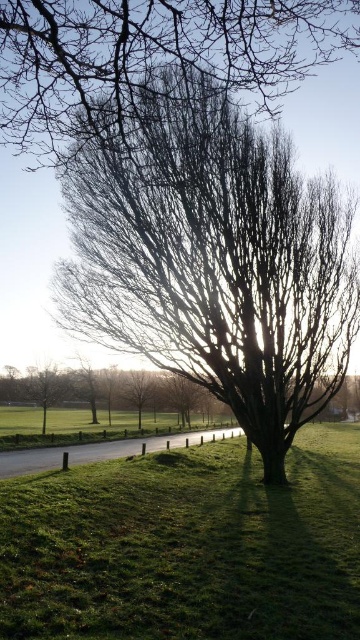
Question: Which object is farther from the camera taking this photo?

Choices:
 (A) bare branches at center
 (B) green leafless tree at lower left
 (C) smooth bark tree at center

Answer: (C)

Question: Which is nearer to the green leafless tree at lower left?

Choices:
 (A) bare branches at center
 (B) green grassy at center
 (C) smooth bark tree at center

Answer: (C)

Question: Is green matte tree at lower left thinner than smooth bark tree at center?

Choices:
 (A) yes
 (B) no

Answer: (A)

Question: Does green grassy at center appear under green matte tree at lower left?

Choices:
 (A) no
 (B) yes

Answer: (A)

Question: Is bare branches at center to the left of smooth bark tree at center from the viewer's perspective?

Choices:
 (A) no
 (B) yes

Answer: (A)

Question: Considering the real-world distances, which object is farthest from the bare branches at center?

Choices:
 (A) green matte tree at lower left
 (B) green leafless tree at lower left
 (C) green grassy at center

Answer: (B)